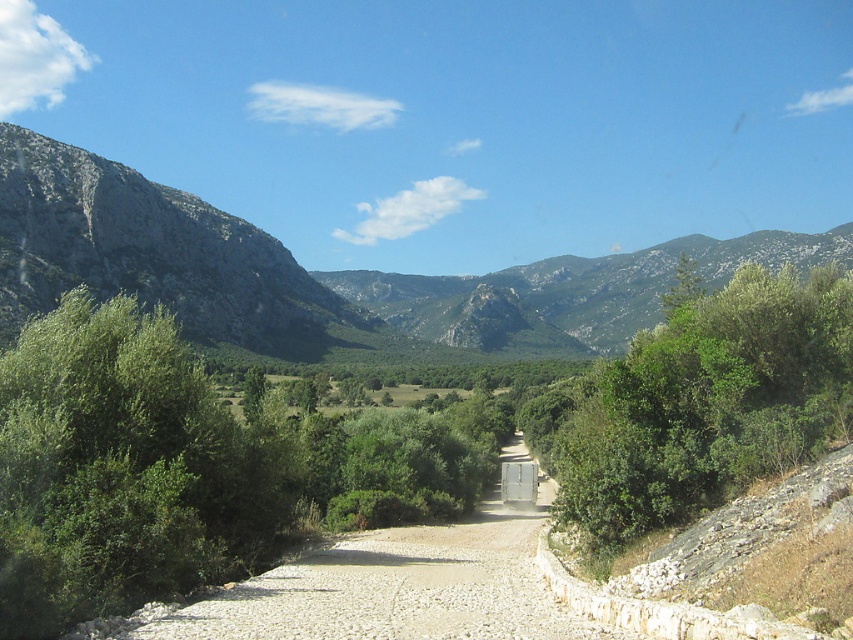
You are a hiker planning to take a photo of both the green rocky mountain at left and the gray rocky mountain at left. Since you want both mountains to be clearly visible in the frame, which mountain should you position closer to the center of your camera viewfinder to ensure it doesn,t get cut off?

The green rocky mountain at left is bigger than the gray rocky mountain at left. To ensure both are clearly visible, position the larger green rocky mountain closer to the center so that the smaller gray rocky mountain can be framed alongside without either being cut off.

In the scene shown: You are a hiker standing at the start of the unpaved road in the foreground. You see the green leafy bush at right and the gray rocky mountain at left. Which object is closer to the ground?

The green leafy bush at right is closer to the ground since it is positioned below the gray rocky mountain at left.

You are a hiker who wants to take a photo of the green rocky mountain at left and the green leafy bush at right from a distance. Which object will appear larger in the photo?

The green rocky mountain at left will appear larger in the photo because it has a greater height compared to the green leafy bush at right.